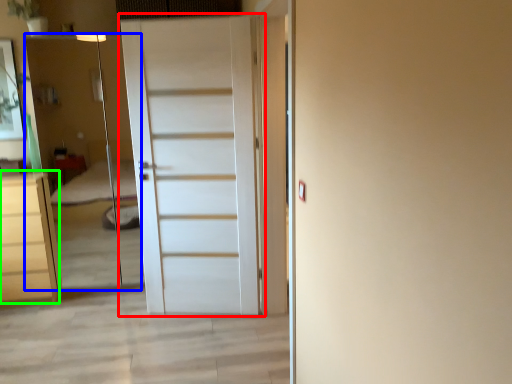
Question: Considering the real-world distances, which object is farthest from door (highlighted by a red box)? elevator (highlighted by a blue box) or chest of drawers (highlighted by a green box)?

Choices:
 (A) elevator
 (B) chest of drawers

Answer: (A)